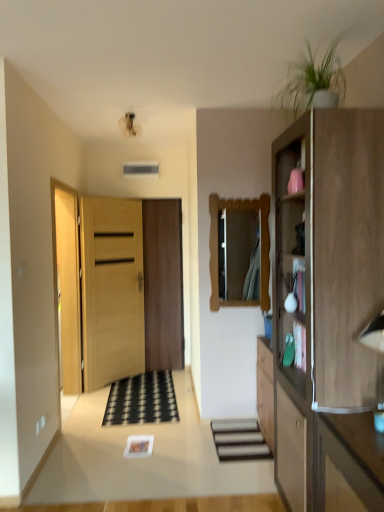
Question: Would you say green matte plant at upper right is outside wooden door at center, acting as the 1th door starting from the front?

Choices:
 (A) no
 (B) yes

Answer: (B)

Question: From the image's perspective, is green matte plant at upper right over wooden door at center, arranged as the 2th door when viewed from the back?

Choices:
 (A) no
 (B) yes

Answer: (B)

Question: Is green matte plant at upper right positioned behind wooden door at center, arranged as the 2th door when viewed from the back?

Choices:
 (A) no
 (B) yes

Answer: (A)

Question: From the image's perspective, is green matte plant at upper right under wooden door at center, acting as the 1th door starting from the front?

Choices:
 (A) no
 (B) yes

Answer: (A)

Question: Does green matte plant at upper right appear on the left side of wooden door at center, acting as the 1th door starting from the front?

Choices:
 (A) no
 (B) yes

Answer: (A)

Question: Is the depth of green matte plant at upper right less than that of wooden door at center, acting as the 1th door starting from the front?

Choices:
 (A) no
 (B) yes

Answer: (B)

Question: Is smooth wooden stairs at center not close to wooden mirror at center?

Choices:
 (A) no
 (B) yes

Answer: (B)

Question: From the image's perspective, is smooth wooden stairs at center beneath wooden mirror at center?

Choices:
 (A) yes
 (B) no

Answer: (A)

Question: Would you say wooden mirror at center is part of smooth wooden stairs at center's contents?

Choices:
 (A) yes
 (B) no

Answer: (B)

Question: Is smooth wooden stairs at center positioned beyond the bounds of wooden mirror at center?

Choices:
 (A) no
 (B) yes

Answer: (B)

Question: Does smooth wooden stairs at center have a lesser height compared to wooden mirror at center?

Choices:
 (A) no
 (B) yes

Answer: (B)

Question: From the image's perspective, is smooth wooden stairs at center above wooden mirror at center?

Choices:
 (A) yes
 (B) no

Answer: (B)

Question: From the image's perspective, does light brown wood cabinet at right appear higher than smooth wooden stairs at center?

Choices:
 (A) yes
 (B) no

Answer: (A)